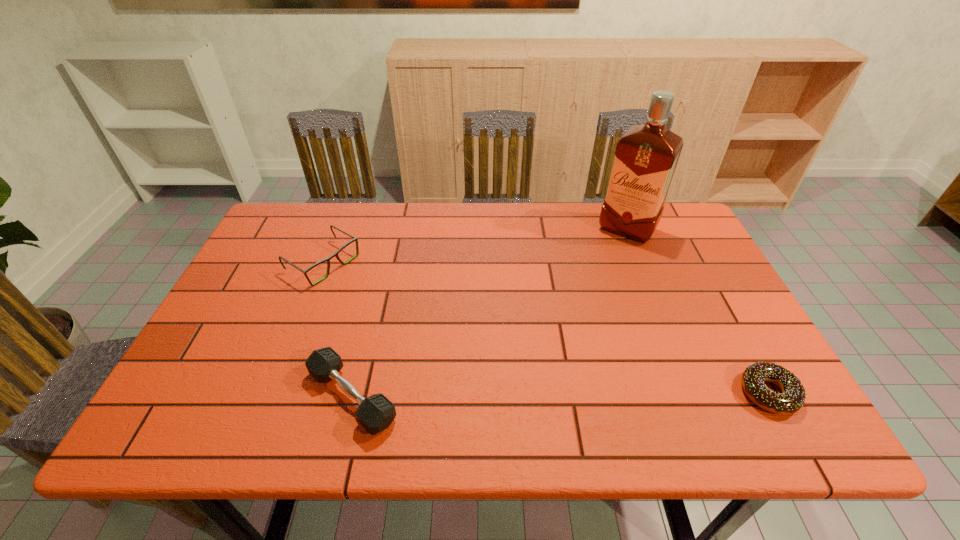
The width and height of the screenshot is (960, 540). I want to click on free space that is in between the spectacles and the tallest object, so click(475, 246).

The height and width of the screenshot is (540, 960). I want to click on free spot between the liquor and the spectacles, so click(x=475, y=246).

Where is `vacant area that lies between the dumbbell and the spectacles`? vacant area that lies between the dumbbell and the spectacles is located at coordinates (338, 330).

Find the location of a particular element. The width and height of the screenshot is (960, 540). blank region between the liquor and the dumbbell is located at coordinates click(x=490, y=313).

Identify the location of free space that is in between the dumbbell and the doughnut. (561, 395).

The height and width of the screenshot is (540, 960). Find the location of `free area in between the dumbbell and the doughnut`. free area in between the dumbbell and the doughnut is located at coordinates (561, 395).

The width and height of the screenshot is (960, 540). I want to click on free spot between the dumbbell and the spectacles, so click(x=338, y=330).

Find the location of a particular element. Image resolution: width=960 pixels, height=540 pixels. free space between the second object from right to left and the spectacles is located at coordinates click(475, 246).

Where is `the closest object relative to the second object from right to left`? This screenshot has width=960, height=540. the closest object relative to the second object from right to left is located at coordinates [x=793, y=396].

Select which object appears as the second closest to the dumbbell. Please provide its 2D coordinates. Your answer should be formatted as a tuple, i.e. [(x, y)], where the tuple contains the x and y coordinates of a point satisfying the conditions above.

[(646, 156)]